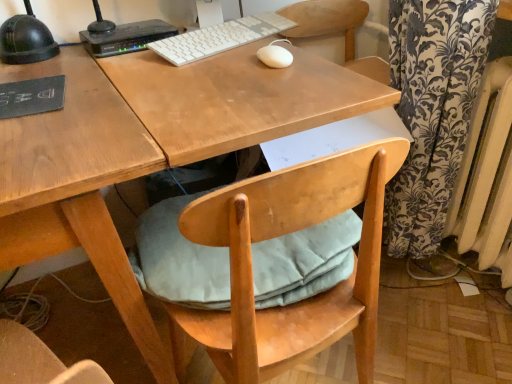
Question: Is light blue fabric cushion at under desk far from white painted metal radiator at right?

Choices:
 (A) yes
 (B) no

Answer: (B)

Question: Considering the relative sizes of light blue fabric cushion at under desk and white painted metal radiator at right in the image provided, is light blue fabric cushion at under desk smaller than white painted metal radiator at right?

Choices:
 (A) yes
 (B) no

Answer: (A)

Question: Could white painted metal radiator at right be considered to be inside light blue fabric cushion at under desk?

Choices:
 (A) yes
 (B) no

Answer: (B)

Question: Considering the relative sizes of light blue fabric cushion at under desk and white painted metal radiator at right in the image provided, is light blue fabric cushion at under desk wider than white painted metal radiator at right?

Choices:
 (A) yes
 (B) no

Answer: (A)

Question: From the image's perspective, is light blue fabric cushion at under desk located above white painted metal radiator at right?

Choices:
 (A) yes
 (B) no

Answer: (B)

Question: Is point (128, 31) closer or farther from the camera than point (274, 59)?

Choices:
 (A) closer
 (B) farther

Answer: (B)

Question: Based on their sizes in the image, would you say black plastic router at upper left is bigger or smaller than white matte mouse at center?

Choices:
 (A) small
 (B) big

Answer: (B)

Question: From the image's perspective, is black plastic router at upper left located above or below white matte mouse at center?

Choices:
 (A) below
 (B) above

Answer: (B)

Question: Considering their positions, is black plastic router at upper left located in front of or behind white matte mouse at center?

Choices:
 (A) front
 (B) behind

Answer: (B)

Question: From the image's perspective, is black plastic router at upper left located above or below white plastic keyboard at upper center?

Choices:
 (A) above
 (B) below

Answer: (A)

Question: Is black plastic router at upper left taller or shorter than white plastic keyboard at upper center?

Choices:
 (A) short
 (B) tall

Answer: (B)

Question: Do you think black plastic router at upper left is within white plastic keyboard at upper center, or outside of it?

Choices:
 (A) inside
 (B) outside

Answer: (B)

Question: Is point (109, 24) closer or farther from the camera than point (260, 21)?

Choices:
 (A) closer
 (B) farther

Answer: (A)

Question: From the image's perspective, is black plastic router at upper left positioned above or below white painted metal radiator at right?

Choices:
 (A) above
 (B) below

Answer: (A)

Question: In the image, is black plastic router at upper left positioned in front of or behind white painted metal radiator at right?

Choices:
 (A) front
 (B) behind

Answer: (B)